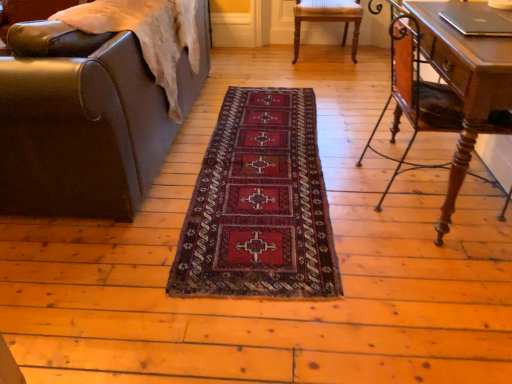
Question: From the image's perspective, relative to leather at left, which is the 1th chair from left to right, is wooden desk at right above or below?

Choices:
 (A) above
 (B) below

Answer: (B)

Question: Is wooden desk at right bigger or smaller than leather at left, marked as the second chair in a back-to-front arrangement?

Choices:
 (A) big
 (B) small

Answer: (B)

Question: Which of these objects is positioned farthest from the wooden desk at right?

Choices:
 (A) wooden chair at center, which appears as the 1th chair when viewed from the back
 (B) leather at left, arranged as the 2th chair when viewed from the right
 (C) silver metallic laptop at upper right
 (D) dark red woven rug at center

Answer: (A)

Question: Which object is positioned closest to the wooden chair at center, marked as the 2th chair in a left-to-right arrangement?

Choices:
 (A) dark red woven rug at center
 (B) wooden desk at right
 (C) leather at left, which is the 1th chair from left to right
 (D) silver metallic laptop at upper right

Answer: (A)